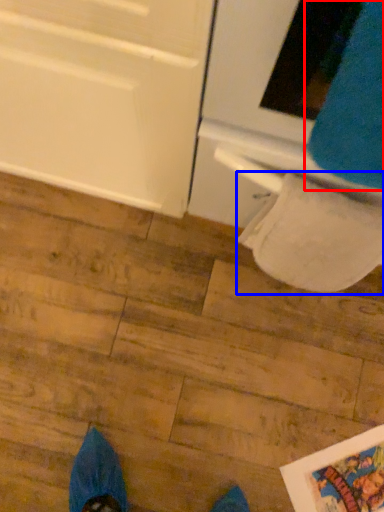
Question: Among these objects, which one is nearest to the camera, sweat pant (highlighted by a red box) or toilet paper (highlighted by a blue box)?

Choices:
 (A) sweat pant
 (B) toilet paper

Answer: (A)